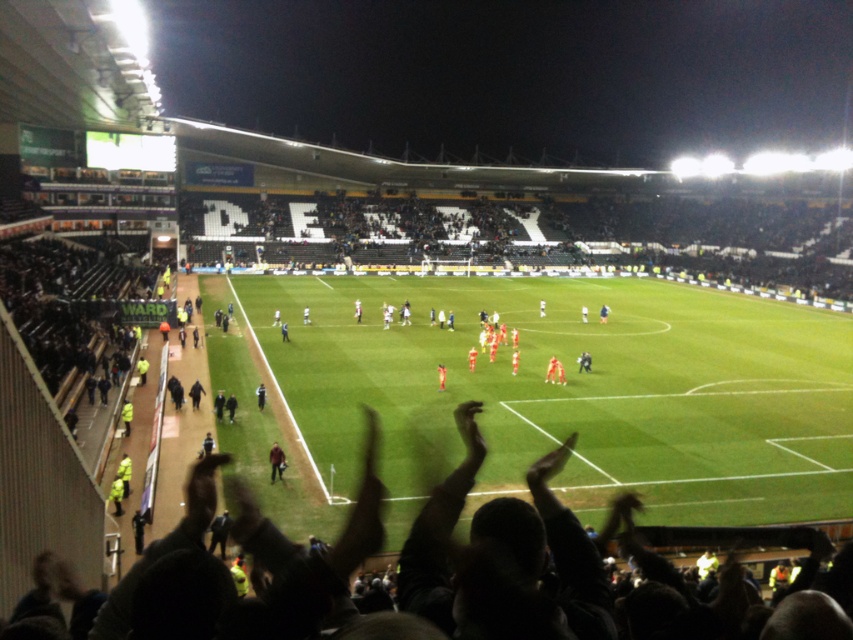
Question: Can you confirm if green grass football field at center is positioned to the right of orange jersey at center?

Choices:
 (A) no
 (B) yes

Answer: (B)

Question: Estimate the real-world distances between objects in this image. Which object is farther from the orange jersey at center?

Choices:
 (A) green grass football field at center
 (B) brown leather jacket at center

Answer: (A)

Question: Does green grass football field at center have a larger size compared to brown leather jacket at center?

Choices:
 (A) yes
 (B) no

Answer: (A)

Question: Among these objects, which one is nearest to the camera?

Choices:
 (A) brown leather jacket at center
 (B) orange jersey at center

Answer: (A)

Question: Is green grass football field at center further to the viewer compared to orange jersey at center?

Choices:
 (A) yes
 (B) no

Answer: (B)

Question: Which of the following is the farthest from the observer?

Choices:
 (A) orange jersey at center
 (B) brown leather jacket at center

Answer: (A)